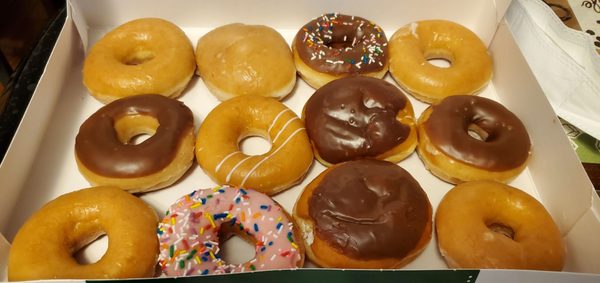
Where is `box`? box is located at coordinates (548, 182).